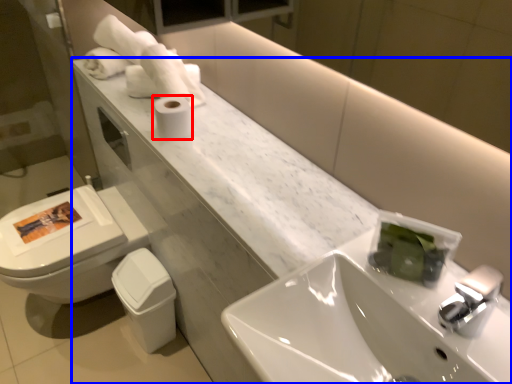
Question: Which point is closer to the camera, toilet paper (highlighted by a red box) or counter (highlighted by a blue box)?

Choices:
 (A) toilet paper
 (B) counter

Answer: (B)